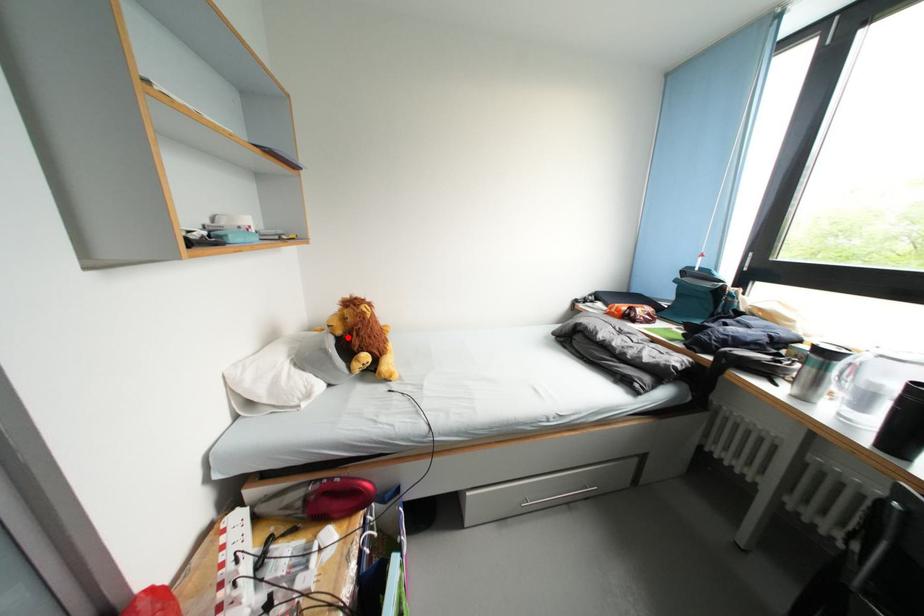
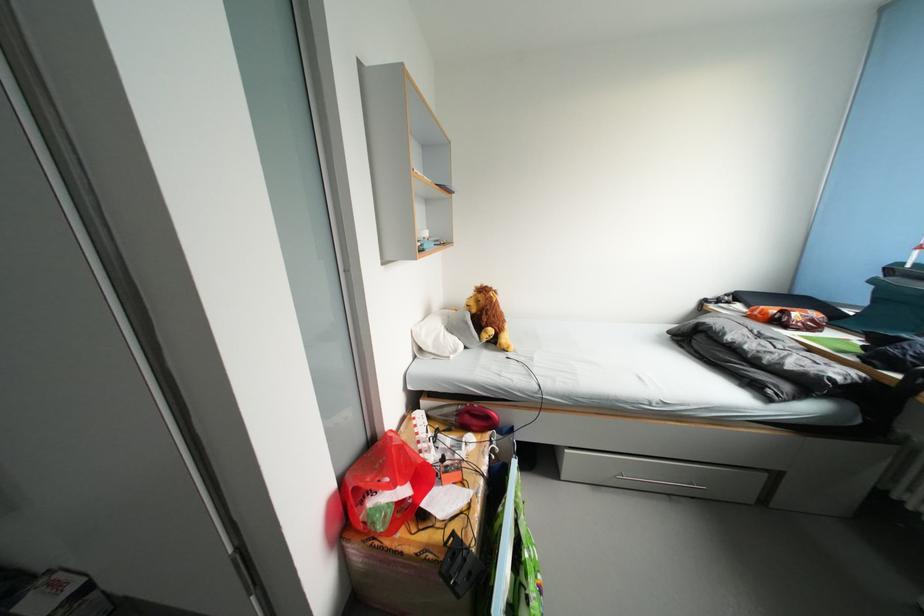
In the second image, find the point that corresponds to the highlighted location in the first image.

(482, 315)